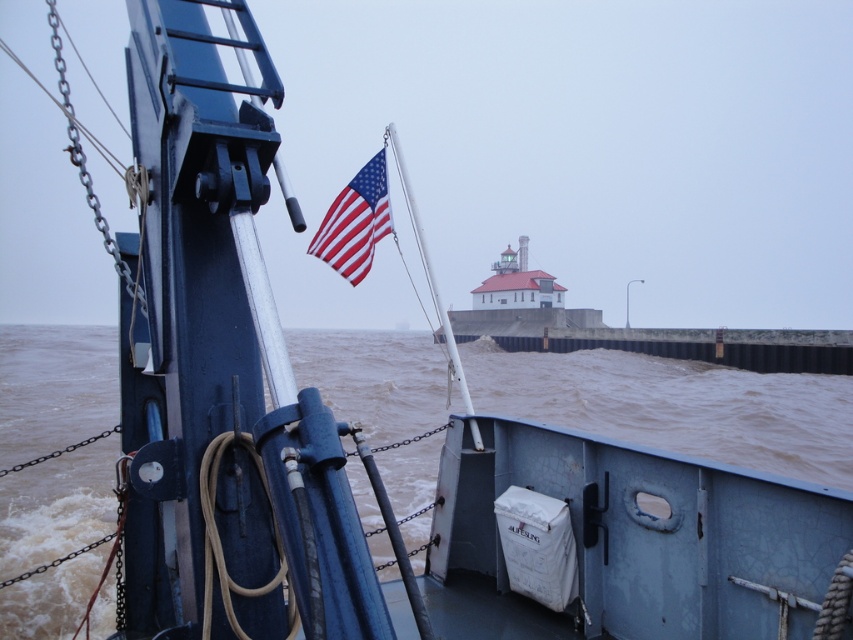
You are standing on the deck of the ship and looking at the point marked as point (x=680, y=406). What do you see at that location?

At point (x=680, y=406), you see brown muddy water at lower center.